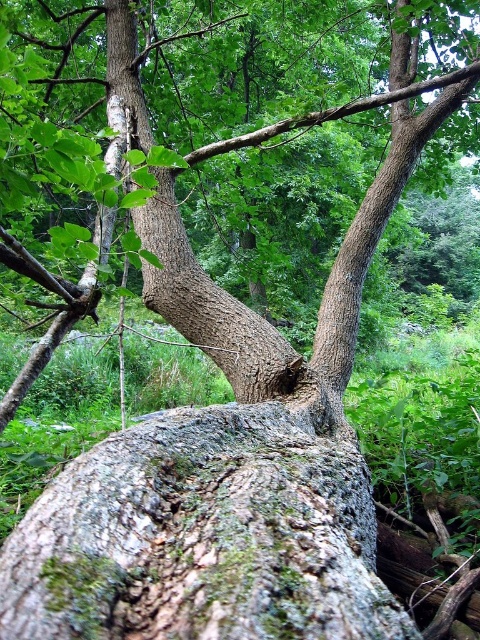
Question: Is green mossy rock at center to the right of rough bark tree at center from the viewer's perspective?

Choices:
 (A) yes
 (B) no

Answer: (A)

Question: Which of the following is the closest to the observer?

Choices:
 (A) rough bark tree at center
 (B) green mossy rock at center

Answer: (B)

Question: Which object is farther from the camera taking this photo?

Choices:
 (A) green mossy rock at center
 (B) rough bark tree at center

Answer: (B)

Question: Can you confirm if green mossy rock at center is bigger than rough bark tree at center?

Choices:
 (A) no
 (B) yes

Answer: (A)

Question: Does green mossy rock at center appear over rough bark tree at center?

Choices:
 (A) no
 (B) yes

Answer: (A)

Question: Which object appears farthest from the camera in this image?

Choices:
 (A) green mossy rock at center
 (B) rough bark tree at center

Answer: (B)